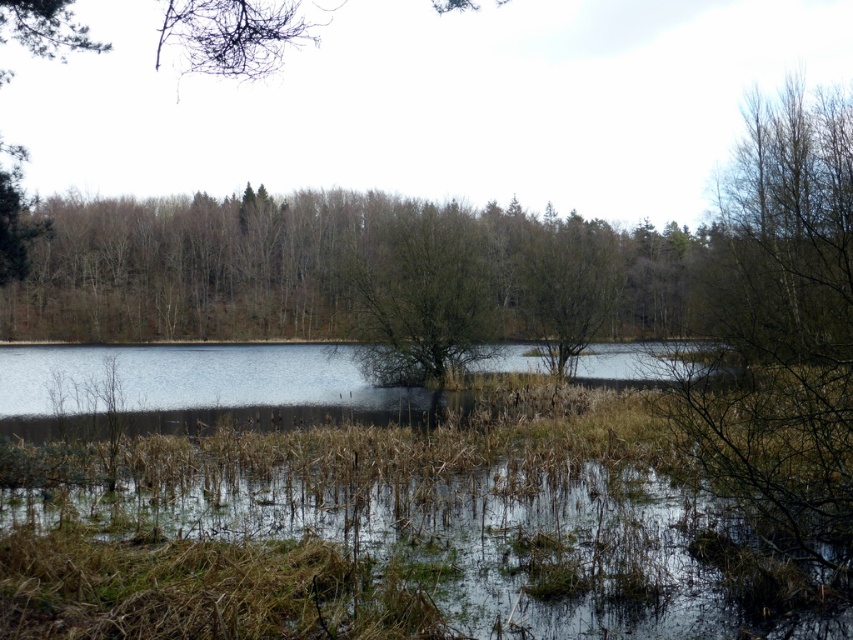
You are an environmental scientist observing the wetland area. You notice two trees in the scene, the green matte tree at center and the brown matte tree at center. Which tree has a smaller height?

The green matte tree at center is smaller than the brown matte tree at center, so the green matte tree at center has a smaller height.

You are standing in the wetland area and notice two trees at the center of the scene. Which tree is positioned higher in the image, the green matte tree at center or the brown matte tree at center?

The green matte tree at center is positioned higher than the brown matte tree at center in the image.